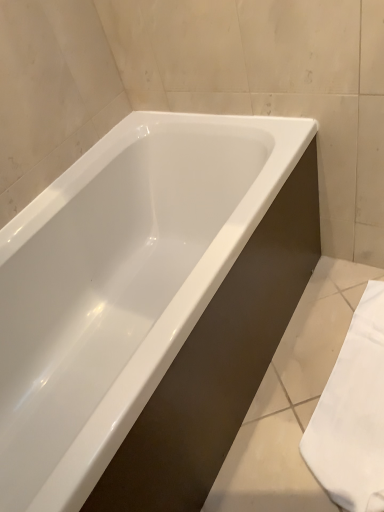
Question: Does point click(185, 459) appear closer or farther from the camera than point click(314, 420)?

Choices:
 (A) farther
 (B) closer

Answer: (B)

Question: Considering their positions, is white glossy bathtub at center located in front of or behind white fabric towel at lower right?

Choices:
 (A) front
 (B) behind

Answer: (A)

Question: From a real-world perspective, is white glossy bathtub at center above or below white fabric towel at lower right?

Choices:
 (A) below
 (B) above

Answer: (B)

Question: From the image's perspective, relative to white glossy bathtub at center, is white fabric towel at lower right above or below?

Choices:
 (A) below
 (B) above

Answer: (A)

Question: Based on their positions, is white fabric towel at lower right located to the left or right of white glossy bathtub at center?

Choices:
 (A) left
 (B) right

Answer: (B)

Question: In terms of size, does white fabric towel at lower right appear bigger or smaller than white glossy bathtub at center?

Choices:
 (A) big
 (B) small

Answer: (B)

Question: Considering the positions of white fabric towel at lower right and white glossy bathtub at center in the image, is white fabric towel at lower right taller or shorter than white glossy bathtub at center?

Choices:
 (A) tall
 (B) short

Answer: (B)